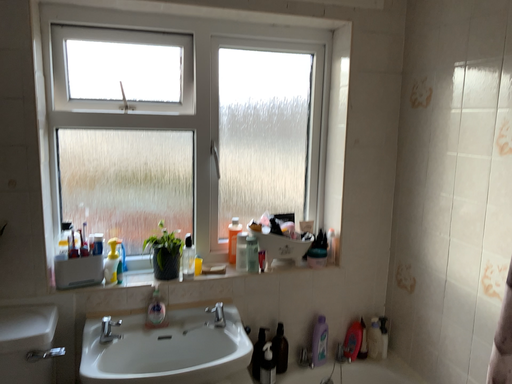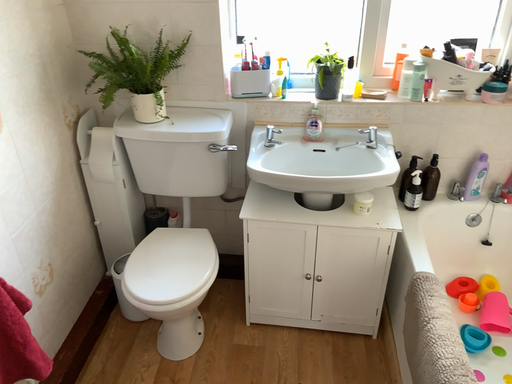
Question: Which way did the camera rotate in the video?

Choices:
 (A) rotated downward
 (B) rotated upward

Answer: (A)